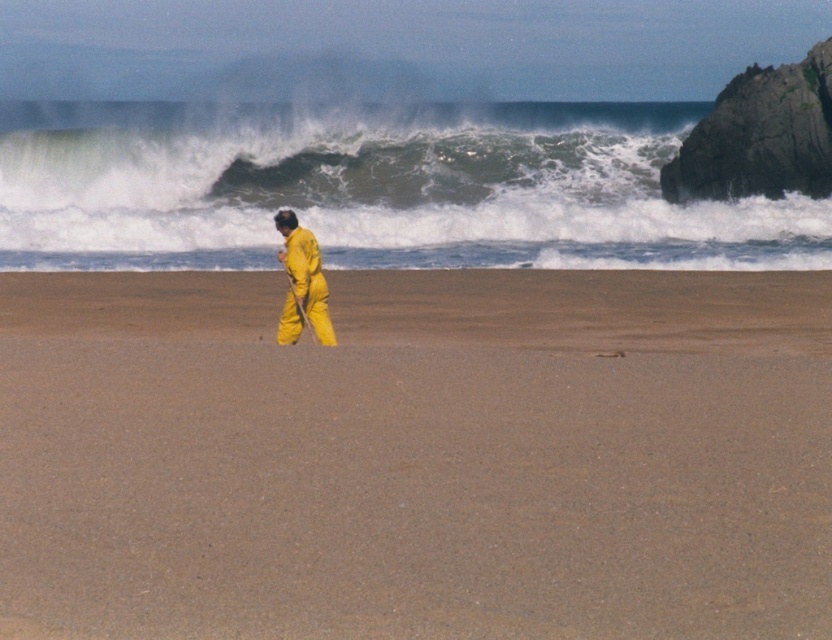
Question: Does smooth sand at center appear on the left side of yellow matte jumpsuit at center?

Choices:
 (A) no
 (B) yes

Answer: (A)

Question: Can you confirm if white frothy water at upper center is bigger than yellow matte jumpsuit at center?

Choices:
 (A) no
 (B) yes

Answer: (B)

Question: Which of the following is the closest to the observer?

Choices:
 (A) (157, 467)
 (B) (293, 301)

Answer: (A)

Question: Which point is farther to the camera?

Choices:
 (A) smooth sand at center
 (B) white frothy water at upper center

Answer: (B)

Question: Is white frothy water at upper center smaller than yellow matte jumpsuit at center?

Choices:
 (A) no
 (B) yes

Answer: (A)

Question: Which point is farther from the camera taking this photo?

Choices:
 (A) (8, 125)
 (B) (327, 323)
 (C) (689, 458)

Answer: (A)